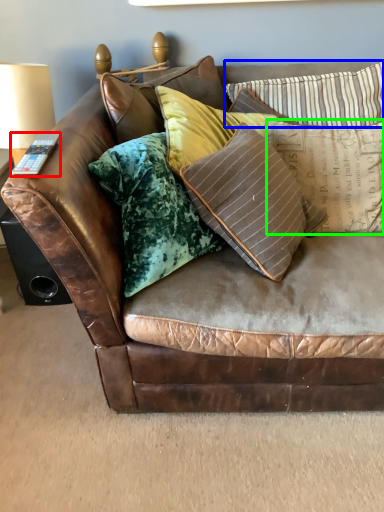
Question: Estimate the real-world distances between objects in this image. Which object is farther from remote (highlighted by a red box), pillow (highlighted by a blue box) or pillow (highlighted by a green box)?

Choices:
 (A) pillow
 (B) pillow

Answer: (A)